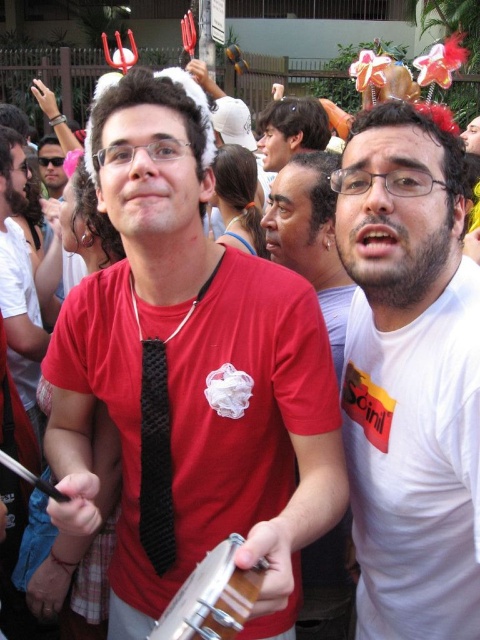
Consider the image. Does matte black tie at center have a greater width compared to matte white wig at center?

Indeed, matte black tie at center has a greater width compared to matte white wig at center.

Is point (322, 396) less distant than point (269, 136)?

Yes, it is in front of point (269, 136).

Describe the element at coordinates (190, 374) in the screenshot. I see `matte black tie at center` at that location.

The image size is (480, 640). Identify the location of matte black tie at center. (190, 374).

Between smooth white shirt at center and black textured tie at center, which one has more height?

smooth white shirt at center is taller.

Between smooth white shirt at center and black textured tie at center, which one appears on the left side from the viewer's perspective?

black textured tie at center is more to the left.

Locate an element on the screen. The height and width of the screenshot is (640, 480). smooth white shirt at center is located at coordinates (311, 237).

You are a GUI agent. You are given a task and a screenshot of the screen. Output one action in this format:
    pyautogui.click(x=<x>, y=<y>)
    Task: Click on the smooth white shirt at center
    The width and height of the screenshot is (480, 640).
    Given the screenshot: What is the action you would take?
    pyautogui.click(x=311, y=237)

Between wooden drum at center and matte white wig at center, which one is positioned lower?

wooden drum at center

Identify the location of wooden drum at center. This screenshot has width=480, height=640. (213, 596).

Find the location of a particular element. wooden drum at center is located at coordinates (213, 596).